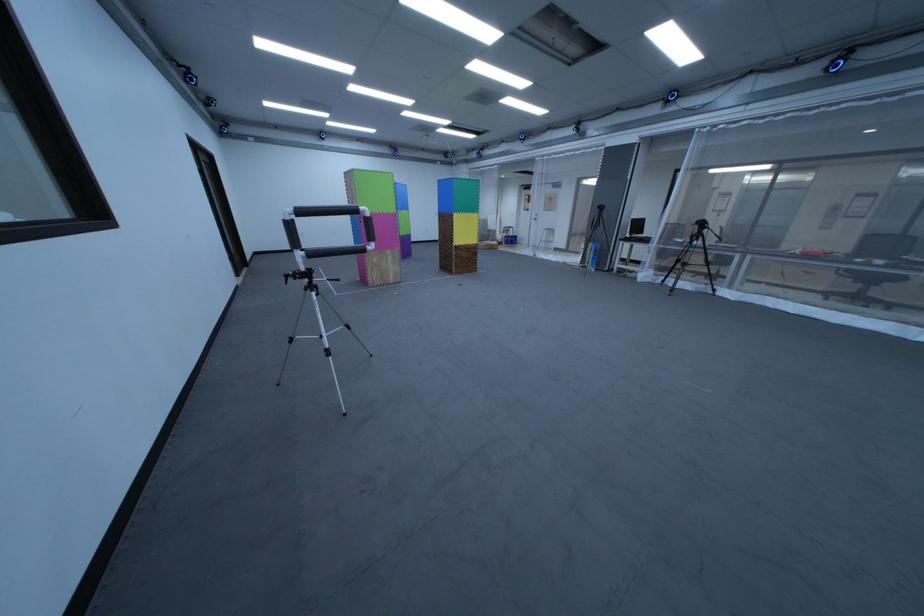
This screenshot has height=616, width=924. I want to click on tripod adjustment knob, so click(290, 276).